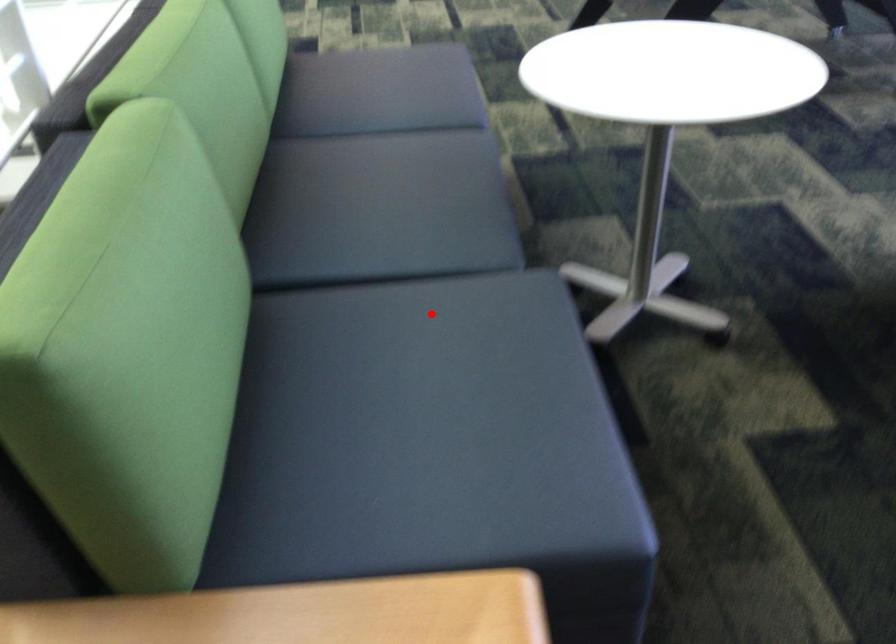
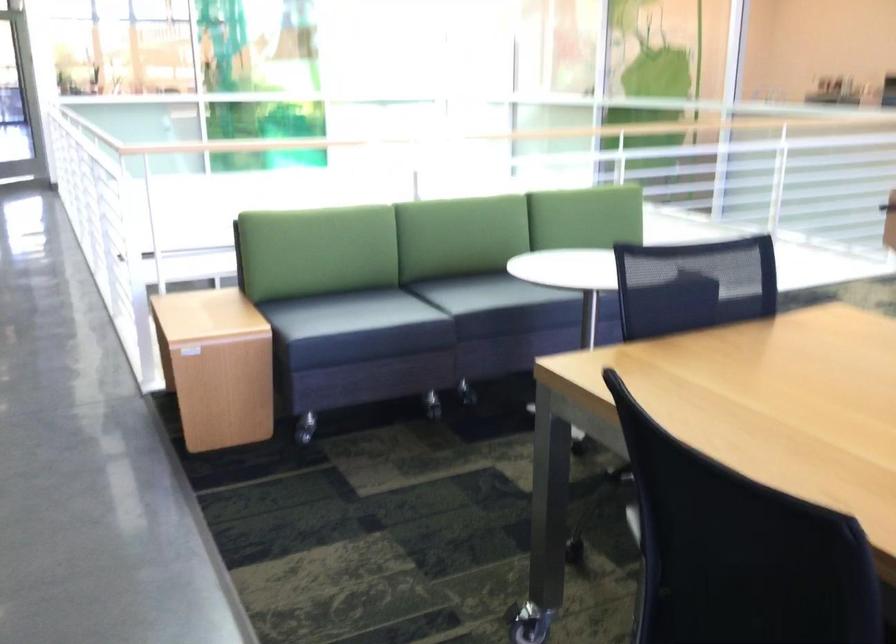
Question: I am providing you with two images of the same scene from different viewpoints. Image1 has a red point marked. In image2, the corresponding 3D location appears at what relative position? Reply with the corresponding letter.

Choices:
 (A) Closer
 (B) Farther

Answer: (B)